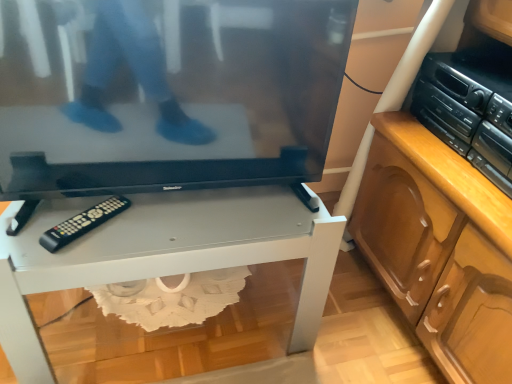
Question: From a real-world perspective, is black glossy television at center located beneath white glossy desk at center?

Choices:
 (A) yes
 (B) no

Answer: (B)

Question: From a real-world perspective, is black glossy television at center physically above white glossy desk at center?

Choices:
 (A) no
 (B) yes

Answer: (B)

Question: Is black glossy television at center positioned far away from white glossy desk at center?

Choices:
 (A) no
 (B) yes

Answer: (A)

Question: Does black glossy television at center have a lesser width compared to white glossy desk at center?

Choices:
 (A) no
 (B) yes

Answer: (B)

Question: Considering the relative positions of black glossy television at center and white glossy desk at center in the image provided, is black glossy television at center to the left of white glossy desk at center from the viewer's perspective?

Choices:
 (A) no
 (B) yes

Answer: (A)

Question: Is the position of black glossy television at center less distant than that of white glossy desk at center?

Choices:
 (A) no
 (B) yes

Answer: (B)

Question: Can you confirm if black plastic stereo at right is positioned to the left of black glossy television at center?

Choices:
 (A) yes
 (B) no

Answer: (B)

Question: Is black plastic stereo at right turned away from black glossy television at center?

Choices:
 (A) no
 (B) yes

Answer: (A)

Question: Is black plastic stereo at right not close to black glossy television at center?

Choices:
 (A) yes
 (B) no

Answer: (B)

Question: Does black plastic stereo at right appear on the right side of black glossy television at center?

Choices:
 (A) no
 (B) yes

Answer: (B)

Question: Is black plastic stereo at right not inside black glossy television at center?

Choices:
 (A) no
 (B) yes

Answer: (B)

Question: From the image's perspective, is black plastic stereo at right under black glossy television at center?

Choices:
 (A) no
 (B) yes

Answer: (A)

Question: From a real-world perspective, is black plastic stereo at right beneath black plastic remote at lower left?

Choices:
 (A) no
 (B) yes

Answer: (A)